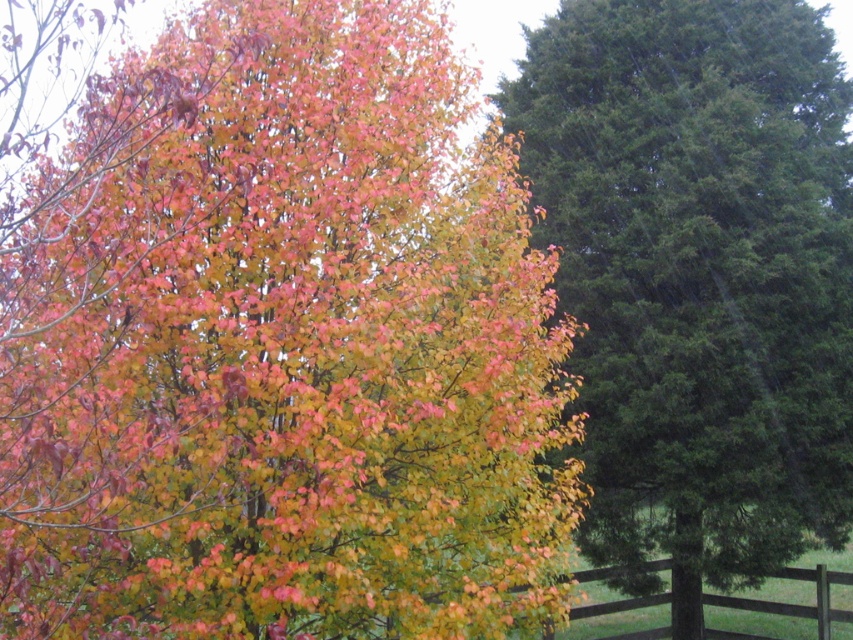
You are standing in the autumn scene and want to take a photo of the brown wooden fence at lower right without the green textured pine tree at right blocking it. How should you position yourself?

Move to the lower right side so that the brown wooden fence at lower right is visible below the green textured pine tree at right, which is positioned above it.

You are a bird looking for a nesting spot. You see the multicolored foliage at center and the green textured pine tree at right. Which location offers a higher nesting point?

The green textured pine tree at right is taller than the multicolored foliage at center, so it offers a higher nesting point.